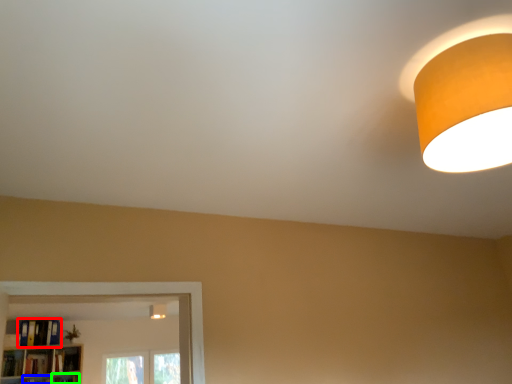
Question: Based on their relative distances, which object is nearer to book (highlighted by a red box)? Choose from shelf (highlighted by a blue box) and shelf (highlighted by a green box).

Choices:
 (A) shelf
 (B) shelf

Answer: (A)